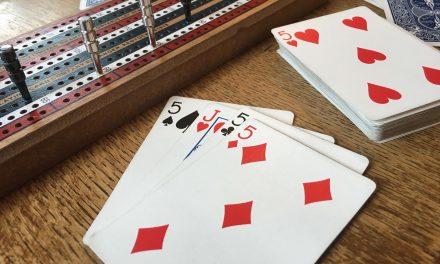
Identify the location of brown table. The height and width of the screenshot is (264, 440). (393, 206).